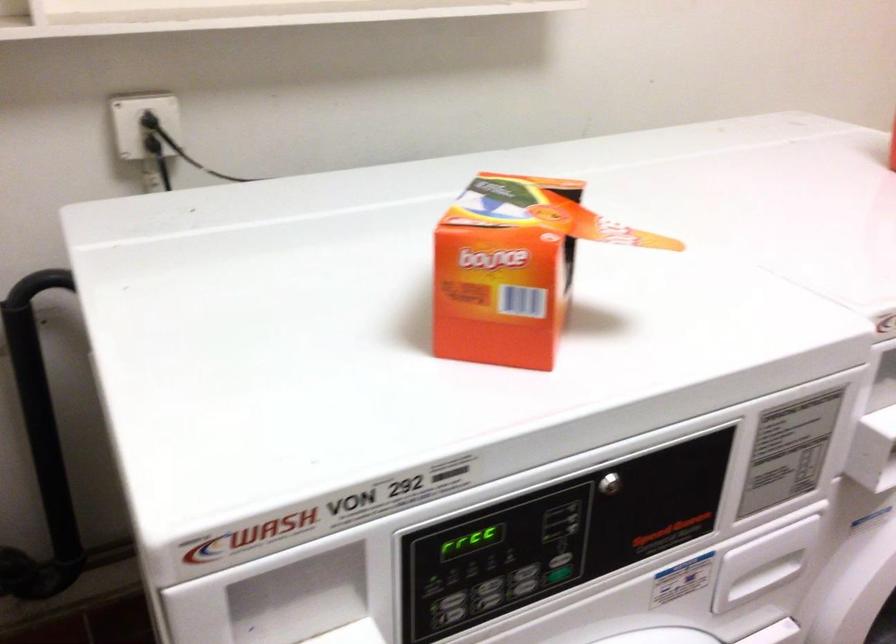
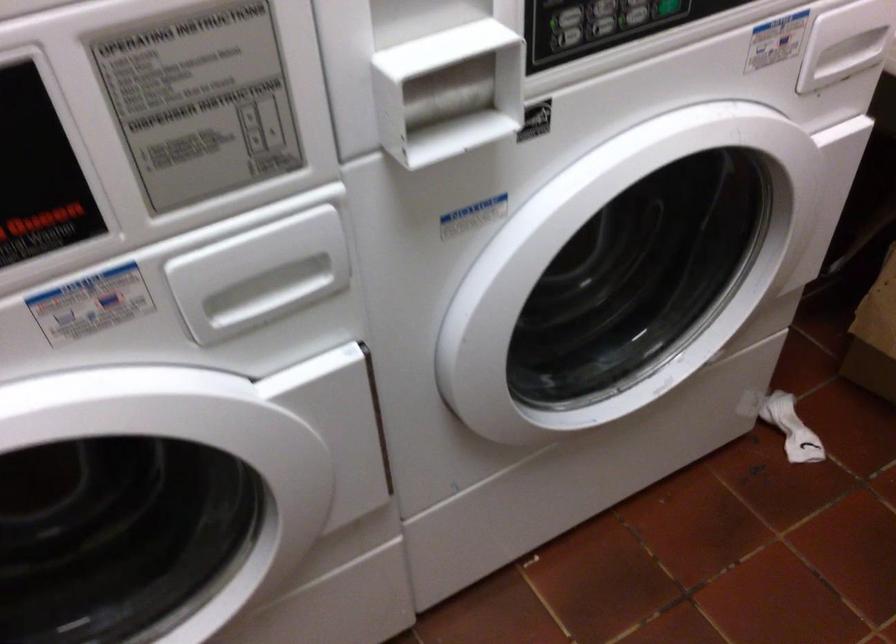
Question: How did the camera likely rotate?

Choices:
 (A) Left
 (B) Right
 (C) Up
 (D) Down

Answer: (D)